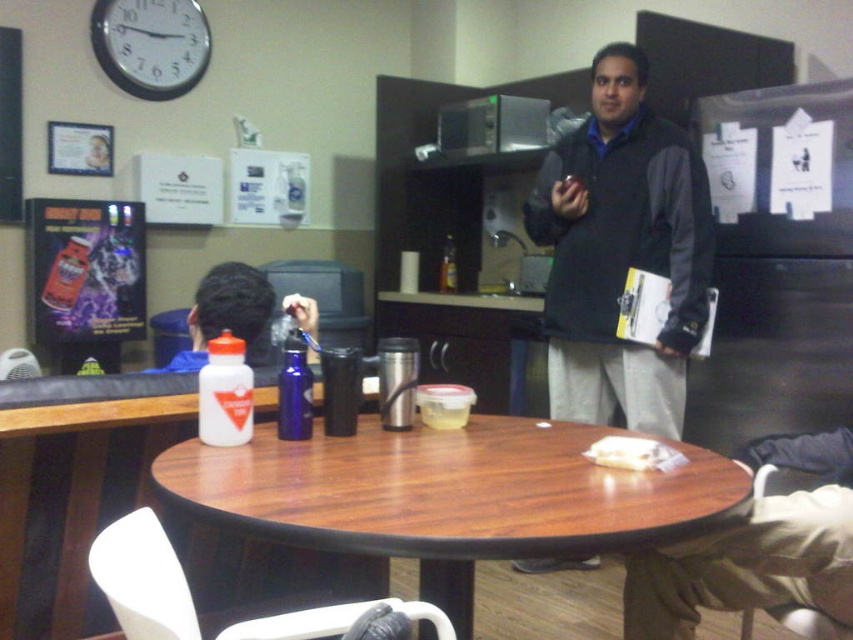
What object is located at the coordinates point (149, 45)?

The point (149, 45) marks the white plastic clock at upper left.